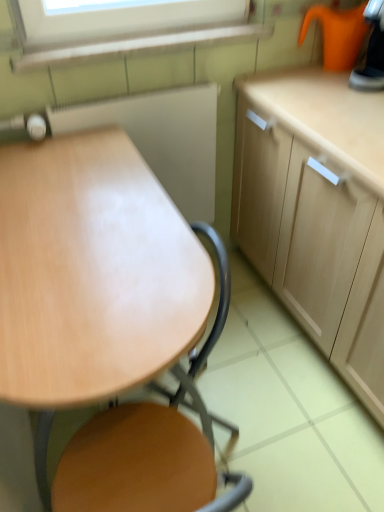
Question: Is orange plastic kettle at upper right, the first appliance positioned from the right, wider or thinner than wooden at center?

Choices:
 (A) thin
 (B) wide

Answer: (A)

Question: From their relative heights in the image, would you say orange plastic kettle at upper right, the second appliance in the bottom-to-top sequence, is taller or shorter than wooden at center?

Choices:
 (A) tall
 (B) short

Answer: (B)

Question: Estimate the real-world distances between objects in this image. Which object is closer to the wooden board at center, which ranks as the 1th appliance in bottom-to-top order?

Choices:
 (A) wooden at center
 (B) wooden table at center
 (C) light wood cabinet at right
 (D) orange plastic kettle at upper right, the 2th appliance from the left

Answer: (C)

Question: Estimate the real-world distances between objects in this image. Which object is farther from the wooden at center?

Choices:
 (A) wooden board at center, the 2th appliance when ordered from top to bottom
 (B) light wood cabinet at right
 (C) wooden table at center
 (D) orange plastic kettle at upper right, positioned as the 1th appliance in top-to-bottom order

Answer: (D)